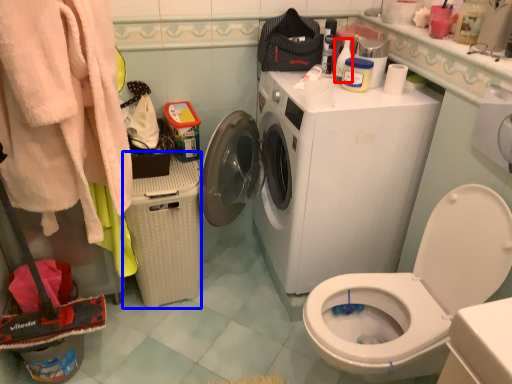
Question: Among these objects, which one is nearest to the camera, cleaning product (highlighted by a red box) or laundry basket (highlighted by a blue box)?

Choices:
 (A) cleaning product
 (B) laundry basket

Answer: (B)